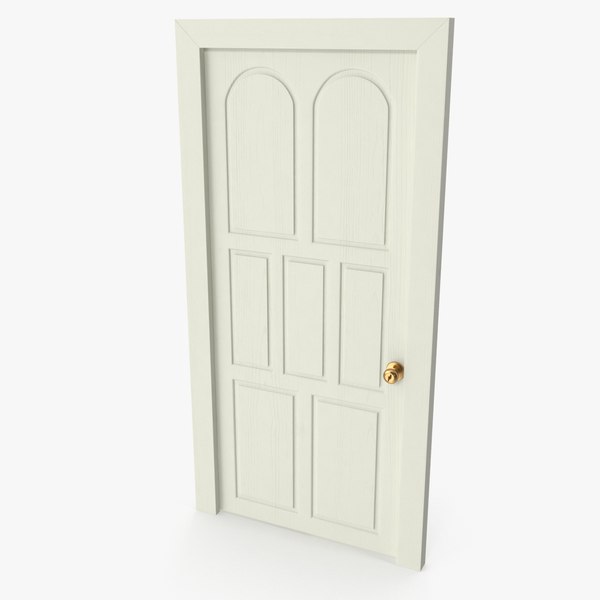
Find the location of a particular element. carved wood panels is located at coordinates (259, 154), (335, 170), (243, 318), (308, 327), (370, 332), (250, 435), (340, 454).